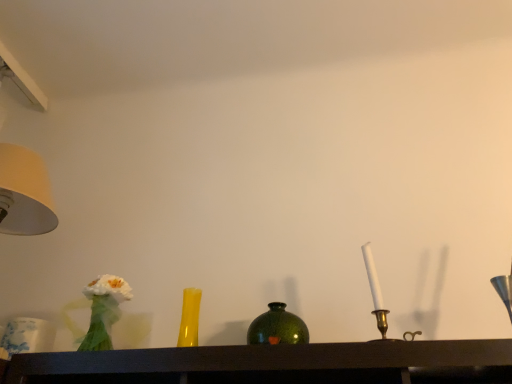
Question: Is white fabric flower at left positioned in front of matte yellow glass vase at center?

Choices:
 (A) no
 (B) yes

Answer: (B)

Question: From a real-world perspective, is white fabric flower at left on matte yellow glass vase at center?

Choices:
 (A) yes
 (B) no

Answer: (B)

Question: Can you confirm if white fabric flower at left is smaller than matte yellow glass vase at center?

Choices:
 (A) no
 (B) yes

Answer: (A)

Question: Is white fabric flower at left taller than matte yellow glass vase at center?

Choices:
 (A) yes
 (B) no

Answer: (A)

Question: Is white fabric flower at left facing towards matte yellow glass vase at center?

Choices:
 (A) no
 (B) yes

Answer: (A)

Question: Is white porcelain candle at right to the left or to the right of matte yellow glass vase at center in the image?

Choices:
 (A) right
 (B) left

Answer: (A)

Question: Considering the positions of white porcelain candle at right and matte yellow glass vase at center in the image, is white porcelain candle at right wider or thinner than matte yellow glass vase at center?

Choices:
 (A) thin
 (B) wide

Answer: (A)

Question: Considering the positions of white porcelain candle at right and matte yellow glass vase at center in the image, is white porcelain candle at right taller or shorter than matte yellow glass vase at center?

Choices:
 (A) short
 (B) tall

Answer: (B)

Question: Do you think white porcelain candle at right is within matte yellow glass vase at center, or outside of it?

Choices:
 (A) outside
 (B) inside

Answer: (A)

Question: Does point (110, 304) appear closer or farther from the camera than point (382, 312)?

Choices:
 (A) closer
 (B) farther

Answer: (B)

Question: From a real-world perspective, is white fabric flower at left above or below white porcelain candle at right?

Choices:
 (A) below
 (B) above

Answer: (A)

Question: Looking at their shapes, would you say white fabric flower at left is wider or thinner than white porcelain candle at right?

Choices:
 (A) thin
 (B) wide

Answer: (B)

Question: Is white fabric flower at left taller or shorter than white porcelain candle at right?

Choices:
 (A) tall
 (B) short

Answer: (B)

Question: Considering the positions of white fabric flower at left and green glass vase at center in the image, is white fabric flower at left wider or thinner than green glass vase at center?

Choices:
 (A) thin
 (B) wide

Answer: (B)

Question: Does point (93, 322) appear closer or farther from the camera than point (280, 316)?

Choices:
 (A) farther
 (B) closer

Answer: (A)